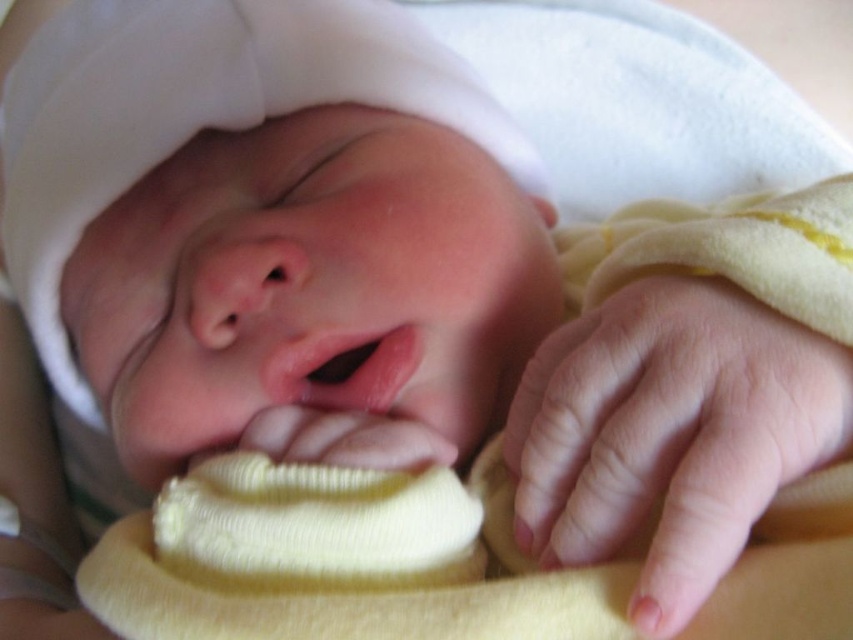
Question: Which object appears closest to the camera in this image?

Choices:
 (A) smooth pink lips at center
 (B) pink smooth skin at center

Answer: (B)

Question: Can you confirm if pink smooth skin at center is positioned to the left of smooth pink lips at center?

Choices:
 (A) no
 (B) yes

Answer: (A)

Question: Is pink smooth skin at center positioned at the back of smooth pink lips at center?

Choices:
 (A) no
 (B) yes

Answer: (A)

Question: Which point is farther from the camera taking this photo?

Choices:
 (A) (701, 385)
 (B) (283, 397)

Answer: (B)

Question: Does pink smooth skin at center appear on the right side of smooth pink lips at center?

Choices:
 (A) no
 (B) yes

Answer: (B)

Question: Which object is farther from the camera taking this photo?

Choices:
 (A) pink smooth skin at center
 (B) smooth pink lips at center

Answer: (B)